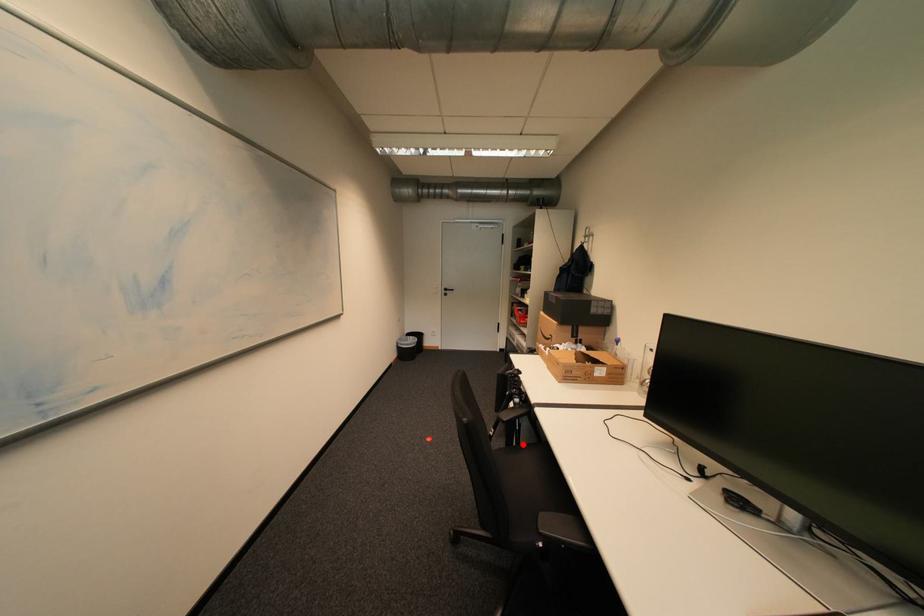
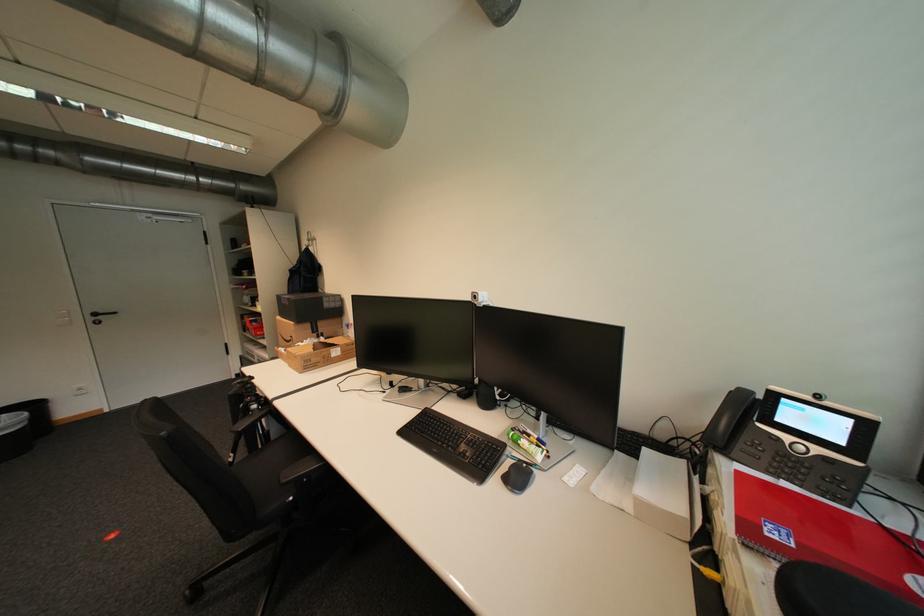
Find the pixel in the second image that matches the highlighted location in the first image.

(269, 448)